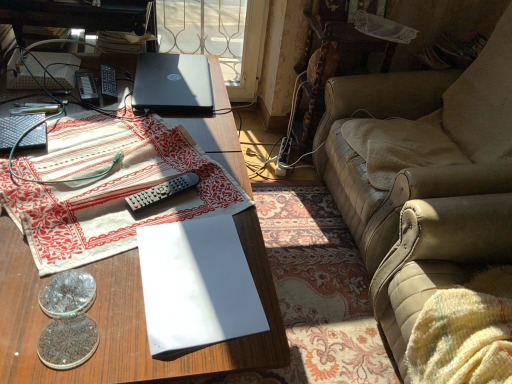
The width and height of the screenshot is (512, 384). Find the location of `vacant space that is in between satin black laptop at upper center and gray plastic remote at center, which ranks as the first remote control in right-to-left order`. vacant space that is in between satin black laptop at upper center and gray plastic remote at center, which ranks as the first remote control in right-to-left order is located at coordinates (166, 145).